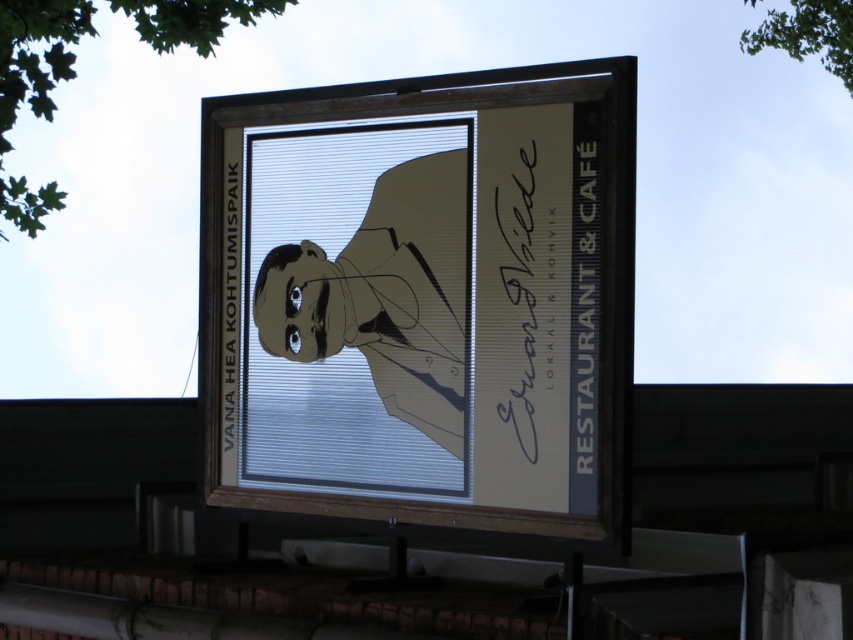
Who is more distant from viewer, (x=489, y=516) or (x=582, y=294)?

Positioned behind is point (x=489, y=516).

Which is more to the left, matte beige signboard at center or black paper at right?

matte beige signboard at center

Who is more distant from viewer, (x=618, y=499) or (x=587, y=404)?

Point (x=587, y=404)

You are a GUI agent. You are given a task and a screenshot of the screen. Output one action in this format:
    pyautogui.click(x=<x>, y=<y>)
    Task: Click on the matte beige signboard at center
    
    Given the screenshot: What is the action you would take?
    pyautogui.click(x=422, y=300)

Does matte beige signboard at center appear on the right side of black paper at left?

Correct, you'll find matte beige signboard at center to the right of black paper at left.

Is matte beige signboard at center smaller than black paper at left?

Actually, matte beige signboard at center might be larger than black paper at left.

Where is `matte beige signboard at center`? This screenshot has height=640, width=853. matte beige signboard at center is located at coordinates (422, 300).

This screenshot has width=853, height=640. In order to click on matte beige signboard at center in this screenshot , I will do (x=422, y=300).

Is the position of black paper at right less distant than that of black paper at left?

Result: Yes, it is.

Who is higher up, black paper at right or black paper at left?

black paper at left is higher up.

Between point (570, 301) and point (229, 157), which one is positioned in front?

Point (570, 301) is in front.

Identify the location of black paper at right. The height and width of the screenshot is (640, 853). pos(584,301).